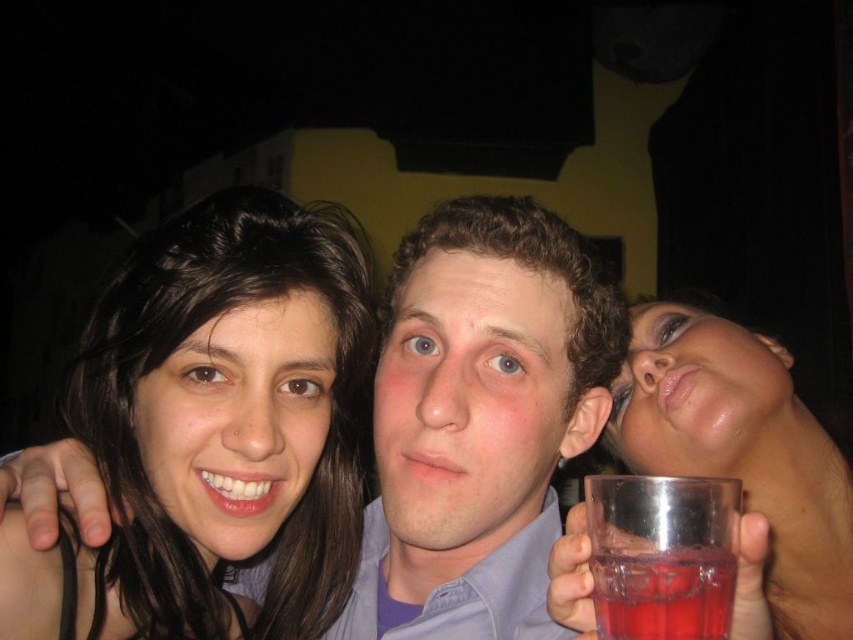
You are a photographer adjusting your camera settings in this dimly lit indoor scene. You need to focus on both the dark brown hair at upper left and the transparent glass at lower right. Which object should you prioritize focusing on first if you want to ensure the one closer to the camera is sharp?

The dark brown hair at upper left has a greater height compared to the transparent glass at lower right, so it is closer to the camera. You should prioritize focusing on the dark brown hair at upper left first to ensure sharpness.